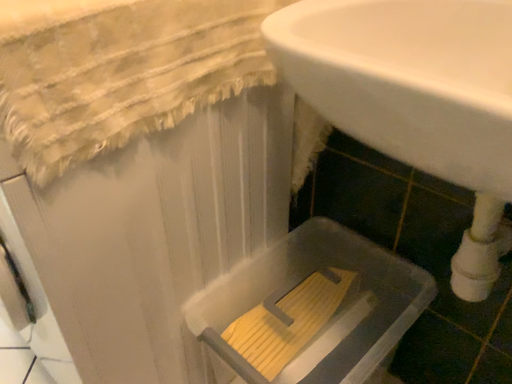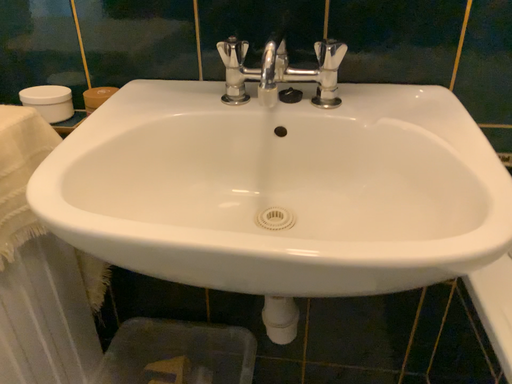
Question: Which way did the camera rotate in the video?

Choices:
 (A) rotated upward
 (B) rotated downward

Answer: (A)